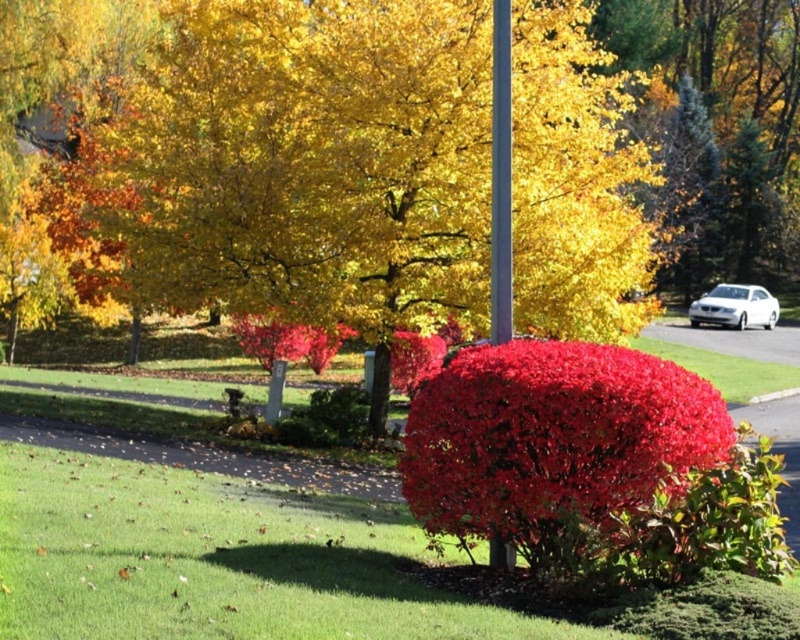
Question: Which point is farther to the camera?

Choices:
 (A) metallic silver pole at center
 (B) white glossy sedan at right

Answer: (B)

Question: Which is nearer to the white glossy sedan at right?

Choices:
 (A) metallic silver pole at center
 (B) shiny red bush at center

Answer: (A)

Question: Does shiny red bush at center lie in front of metallic silver pole at center?

Choices:
 (A) no
 (B) yes

Answer: (B)

Question: Can you confirm if metallic silver pole at center is bigger than white glossy sedan at right?

Choices:
 (A) yes
 (B) no

Answer: (B)

Question: Considering the relative positions of metallic silver pole at center and white glossy sedan at right in the image provided, where is metallic silver pole at center located with respect to white glossy sedan at right?

Choices:
 (A) right
 (B) left

Answer: (B)

Question: Which object is farther from the camera taking this photo?

Choices:
 (A) metallic silver pole at center
 (B) shiny red bush at center

Answer: (A)